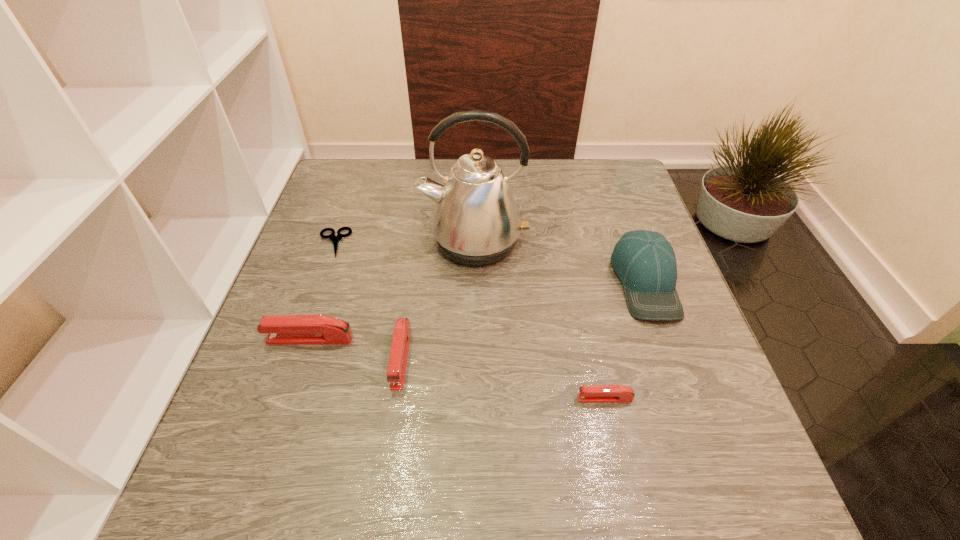
At what (x,y) coordinates should I click in order to perform the action: click on the leftmost stapler. Please return your answer as a coordinate pair (x, y). The image size is (960, 540). Looking at the image, I should click on (283, 329).

You are a GUI agent. You are given a task and a screenshot of the screen. Output one action in this format:
    pyautogui.click(x=<x>, y=<y>)
    Task: Click on the third shortest object
    The width and height of the screenshot is (960, 540).
    Given the screenshot: What is the action you would take?
    pyautogui.click(x=397, y=364)

The image size is (960, 540). Identify the location of the second stapler from right to left. (397, 364).

Image resolution: width=960 pixels, height=540 pixels. What are the coordinates of `the shortest stapler` in the screenshot? It's located at (587, 393).

This screenshot has height=540, width=960. In order to click on the nearest stapler in this screenshot , I will do `click(587, 393)`.

Where is `the shortest object`? This screenshot has width=960, height=540. the shortest object is located at coordinates (335, 239).

The width and height of the screenshot is (960, 540). What are the coordinates of `baseball cap` in the screenshot? It's located at (645, 262).

The width and height of the screenshot is (960, 540). I want to click on the fifth shortest object, so click(x=645, y=262).

You are a GUI agent. You are given a task and a screenshot of the screen. Output one action in this format:
    pyautogui.click(x=<x>, y=<y>)
    Task: Click on the tallest object
    The height and width of the screenshot is (540, 960).
    Given the screenshot: What is the action you would take?
    pyautogui.click(x=476, y=222)

Where is `free space located 0.090m on the front-facing side of the fourth tallest object`? This screenshot has width=960, height=540. free space located 0.090m on the front-facing side of the fourth tallest object is located at coordinates (390, 437).